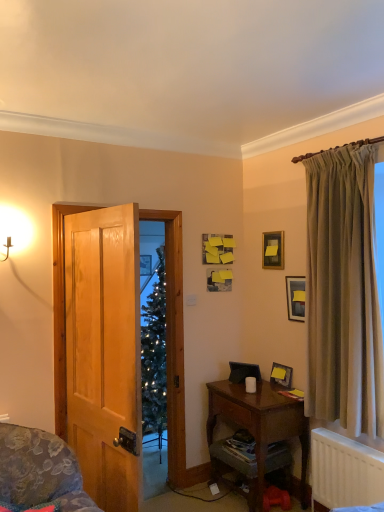
Question: Considering the positions of point (327, 360) and point (283, 266), is point (327, 360) closer or farther from the camera than point (283, 266)?

Choices:
 (A) closer
 (B) farther

Answer: (A)

Question: From a real-world perspective, is silky beige curtain at right positioned above or below wooden picture frame at upper center, placed as the third picture frame when sorted from bottom to top?

Choices:
 (A) above
 (B) below

Answer: (B)

Question: Which of these objects is positioned farthest from the wooden cabinet at lower right?

Choices:
 (A) wooden desk at lower right
 (B) matte black picture frame at lower right, which appears as the 3th picture frame when viewed from the top
 (C) matte black picture frame at upper center, which is the 2th picture frame from bottom to top
 (D) silky beige curtain at right
 (E) white matte coffee cup at lower center

Answer: (C)

Question: Based on their relative distances, which object is nearer to the white matte coffee cup at lower center?

Choices:
 (A) matte gold sconce at upper left
 (B) wooden door at left
 (C) wooden cabinet at lower right
 (D) matte black picture frame at lower right, which appears as the 1th picture frame when ordered from the bottom
 (E) white plastic radiator at lower right

Answer: (D)